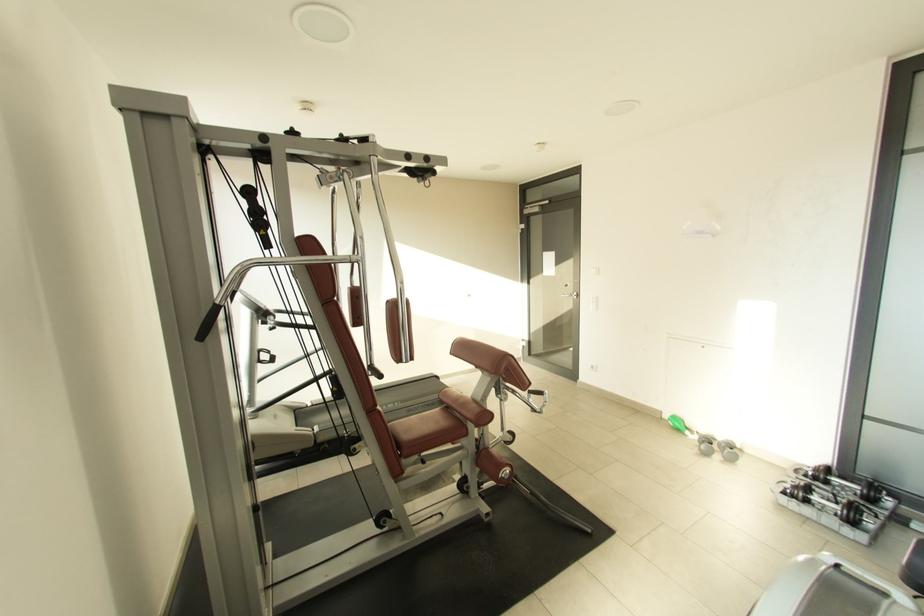
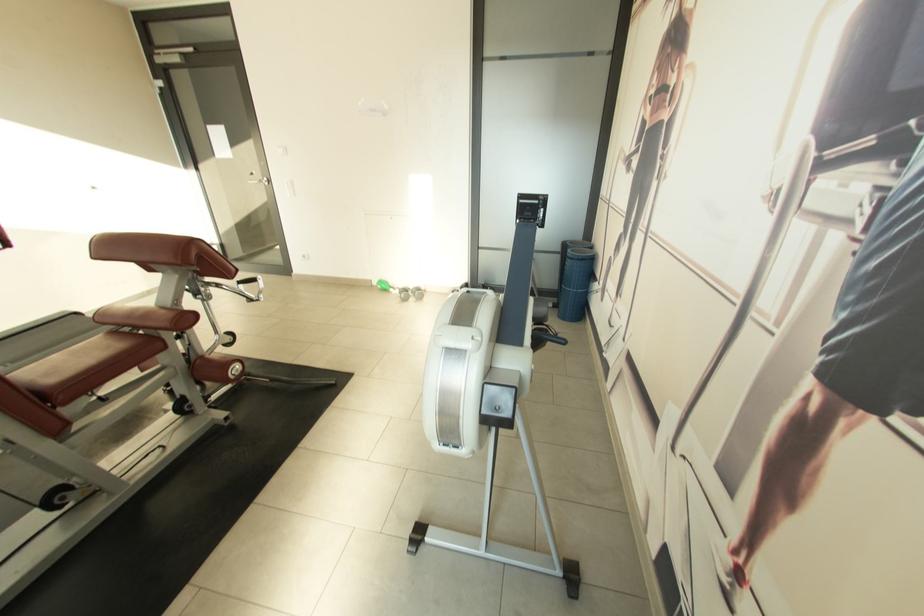
Based on the continuous images, in which direction is the camera rotating?

The camera rotated toward right-down.